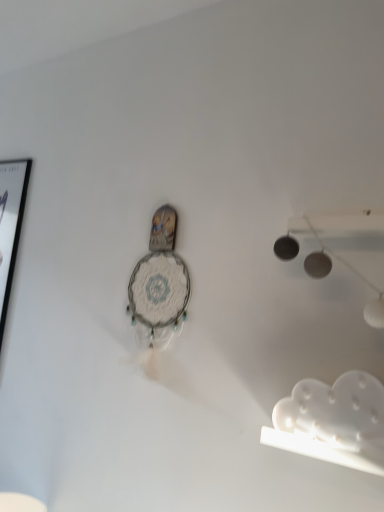
Question: Can you confirm if white lace clock at center is wider than white matte cloud at lower right?

Choices:
 (A) yes
 (B) no

Answer: (A)

Question: Considering the relative sizes of white lace clock at center and white matte cloud at lower right in the image provided, is white lace clock at center bigger than white matte cloud at lower right?

Choices:
 (A) yes
 (B) no

Answer: (A)

Question: Can we say white lace clock at center lies outside white matte cloud at lower right?

Choices:
 (A) yes
 (B) no

Answer: (A)

Question: Is white matte cloud at lower right at the back of white lace clock at center?

Choices:
 (A) yes
 (B) no

Answer: (B)

Question: From the image's perspective, does white lace clock at center appear lower than white matte cloud at lower right?

Choices:
 (A) yes
 (B) no

Answer: (B)

Question: In terms of size, does white matte cloud at lower right appear bigger or smaller than white lace clock at center?

Choices:
 (A) small
 (B) big

Answer: (A)

Question: Would you say white matte cloud at lower right is inside or outside white lace clock at center?

Choices:
 (A) outside
 (B) inside

Answer: (A)

Question: In the image, is white matte cloud at lower right on the left side or the right side of white lace clock at center?

Choices:
 (A) left
 (B) right

Answer: (B)

Question: From a real-world perspective, relative to white lace clock at center, is white matte cloud at lower right vertically above or below?

Choices:
 (A) below
 (B) above

Answer: (A)

Question: Is white lace clock at center taller or shorter than black glossy picture frame at left?

Choices:
 (A) tall
 (B) short

Answer: (B)

Question: From the image's perspective, is white lace clock at center above or below black glossy picture frame at left?

Choices:
 (A) above
 (B) below

Answer: (B)

Question: Considering the relative positions of white lace clock at center and black glossy picture frame at left in the image provided, is white lace clock at center to the left or to the right of black glossy picture frame at left?

Choices:
 (A) left
 (B) right

Answer: (B)

Question: In terms of size, does white lace clock at center appear bigger or smaller than black glossy picture frame at left?

Choices:
 (A) small
 (B) big

Answer: (A)

Question: Considering their positions, is white matte cloud at lower right located in front of or behind black glossy picture frame at left?

Choices:
 (A) behind
 (B) front

Answer: (B)

Question: From a real-world perspective, is white matte cloud at lower right above or below black glossy picture frame at left?

Choices:
 (A) below
 (B) above

Answer: (A)